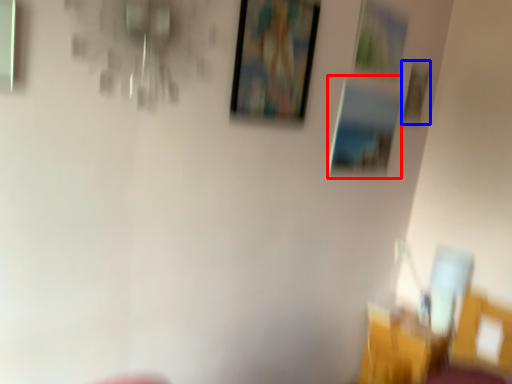
Question: Which object is closer to the camera taking this photo, picture frame (highlighted by a red box) or picture frame (highlighted by a blue box)?

Choices:
 (A) picture frame
 (B) picture frame

Answer: (A)